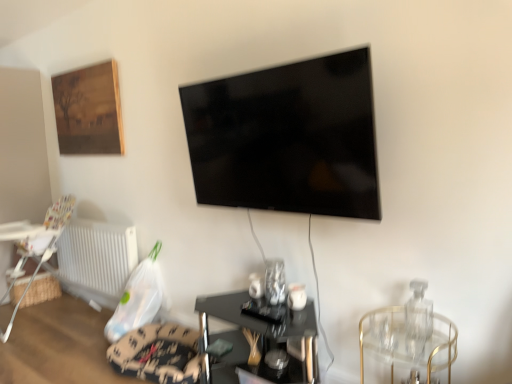
Locate an element on the screen. The height and width of the screenshot is (384, 512). vacant area to the left of velvet-like beige swivel chair at lower center is located at coordinates (65, 365).